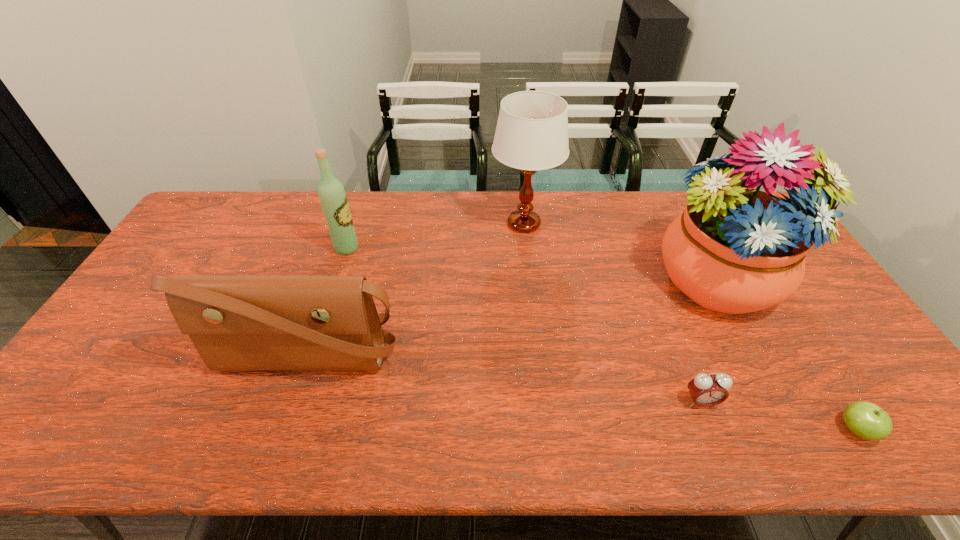
Locate an element on the screen. flower arrangement is located at coordinates (734, 249).

The width and height of the screenshot is (960, 540). I want to click on the fourth object from right to left, so click(x=532, y=130).

Where is `wine bottle`? This screenshot has height=540, width=960. wine bottle is located at coordinates 333,199.

Where is `satchel`? satchel is located at coordinates (237, 323).

Identify the location of alarm clock. This screenshot has width=960, height=540. (706, 390).

The image size is (960, 540). Identify the location of the fifth farthest object. (706, 390).

Locate an element on the screen. This screenshot has height=540, width=960. apple is located at coordinates (866, 420).

Where is `the shortest object`? The image size is (960, 540). the shortest object is located at coordinates (866, 420).

This screenshot has width=960, height=540. Identify the location of vacant space located on the back of the flower arrangement. (691, 227).

Where is `free location located on the right of the table lamp`? free location located on the right of the table lamp is located at coordinates (630, 224).